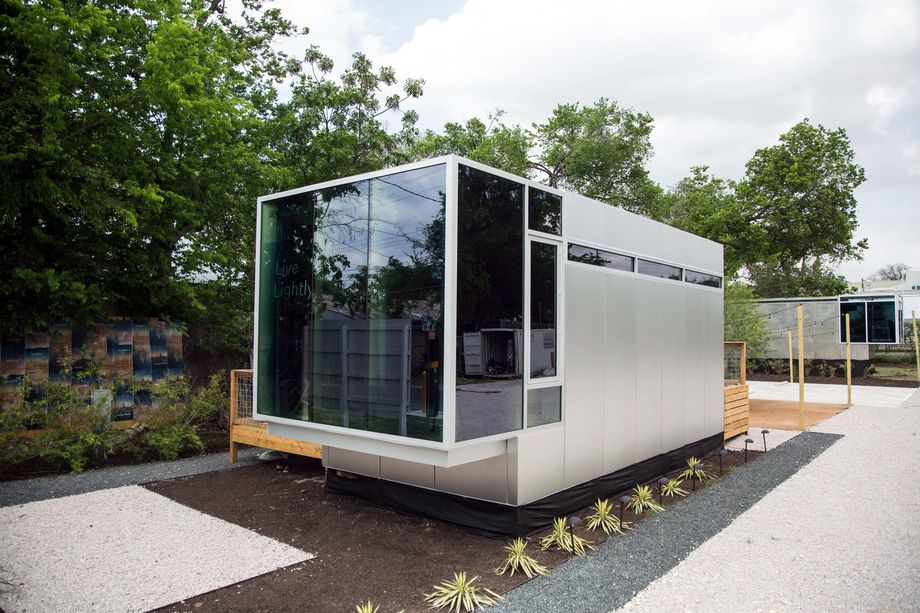
The height and width of the screenshot is (613, 920). I want to click on corners, so click(x=446, y=438), click(x=447, y=158), click(x=258, y=200), click(x=253, y=414).